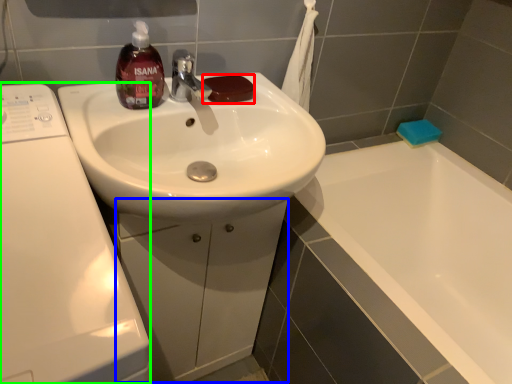
Question: Estimate the real-world distances between objects in this image. Which object is closer to soap (highlighted by a red box), drawer (highlighted by a blue box) or washing machine (highlighted by a green box)?

Choices:
 (A) drawer
 (B) washing machine

Answer: (B)